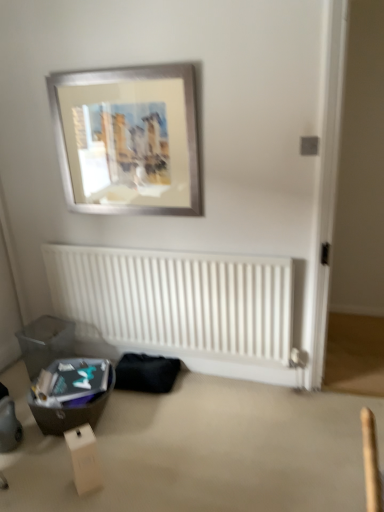
Question: Is white matte radiator at lower center bigger than matte black storage box at lower left, marked as the 1th storage box in a front-to-back arrangement?

Choices:
 (A) no
 (B) yes

Answer: (B)

Question: Is white matte radiator at lower center positioned beyond the bounds of matte black storage box at lower left, which is the second storage box from back to front?

Choices:
 (A) no
 (B) yes

Answer: (B)

Question: Considering the relative sizes of white matte radiator at lower center and matte black storage box at lower left, which is the second storage box from back to front, in the image provided, is white matte radiator at lower center taller than matte black storage box at lower left, which is the second storage box from back to front,?

Choices:
 (A) no
 (B) yes

Answer: (B)

Question: Is matte black storage box at lower left, which is the second storage box from back to front, a part of white matte radiator at lower center?

Choices:
 (A) no
 (B) yes

Answer: (A)

Question: Does white matte radiator at lower center have a greater width compared to matte black storage box at lower left, marked as the 1th storage box in a front-to-back arrangement?

Choices:
 (A) no
 (B) yes

Answer: (A)

Question: Is white matte radiator at lower center smaller than matte black storage box at lower left, which is the second storage box from back to front?

Choices:
 (A) yes
 (B) no

Answer: (B)

Question: Considering the relative sizes of translucent plastic storage box at lower left, which is the second storage box in front-to-back order, and silver metallic picture frame at upper center in the image provided, is translucent plastic storage box at lower left, which is the second storage box in front-to-back order, bigger than silver metallic picture frame at upper center?

Choices:
 (A) yes
 (B) no

Answer: (B)

Question: Is translucent plastic storage box at lower left, which is the second storage box in front-to-back order, at the left side of silver metallic picture frame at upper center?

Choices:
 (A) yes
 (B) no

Answer: (A)

Question: From the image's perspective, is translucent plastic storage box at lower left, which is the second storage box in front-to-back order, on silver metallic picture frame at upper center?

Choices:
 (A) yes
 (B) no

Answer: (B)

Question: Can we say translucent plastic storage box at lower left, which is the second storage box in front-to-back order, lies outside silver metallic picture frame at upper center?

Choices:
 (A) yes
 (B) no

Answer: (A)

Question: Considering the relative sizes of translucent plastic storage box at lower left, the first storage box viewed from the back, and silver metallic picture frame at upper center in the image provided, is translucent plastic storage box at lower left, the first storage box viewed from the back, taller than silver metallic picture frame at upper center?

Choices:
 (A) no
 (B) yes

Answer: (A)

Question: From a real-world perspective, is translucent plastic storage box at lower left, the first storage box viewed from the back, over silver metallic picture frame at upper center?

Choices:
 (A) yes
 (B) no

Answer: (B)

Question: From a real-world perspective, does white cardboard box at lower left sit lower than white matte radiator at lower center?

Choices:
 (A) no
 (B) yes

Answer: (B)